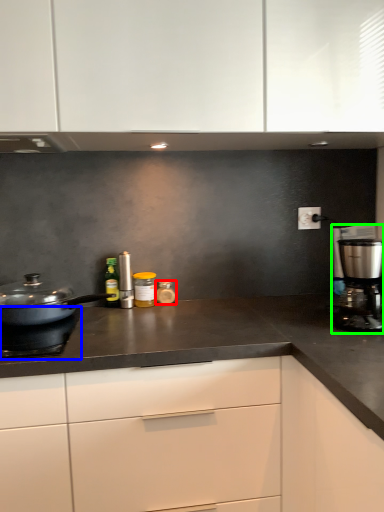
Question: Which object is positioned closest to kitchen appliance (highlighted by a red box)? Select from gas stove (highlighted by a blue box) and kitchen appliance (highlighted by a green box).

Choices:
 (A) gas stove
 (B) kitchen appliance

Answer: (A)